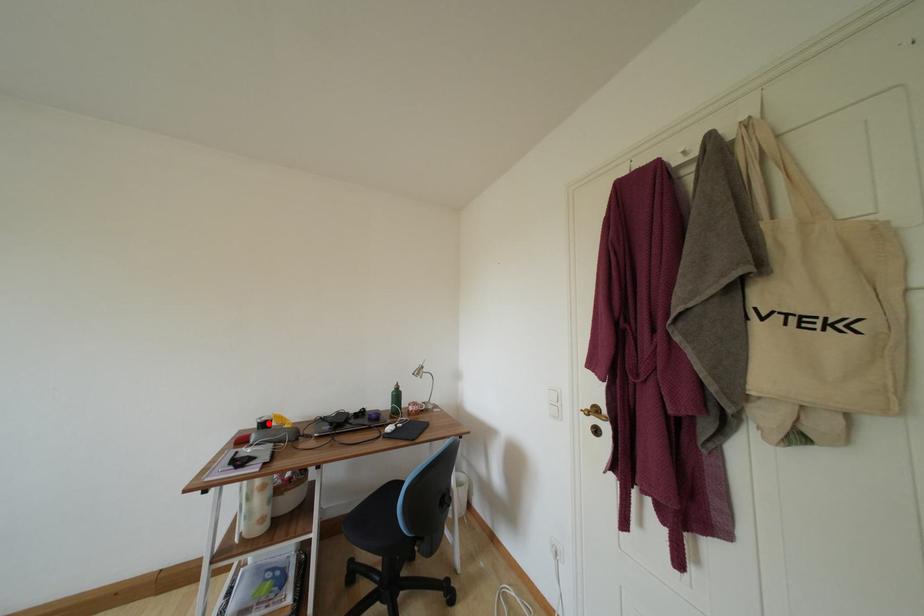
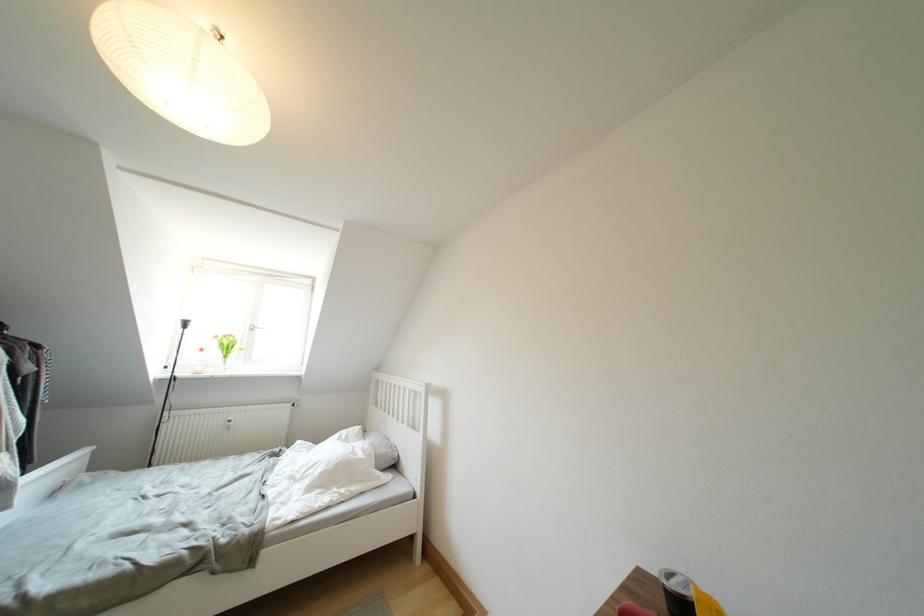
Find the pixel in the second image that matches the highlighted location in the first image.

(678, 589)